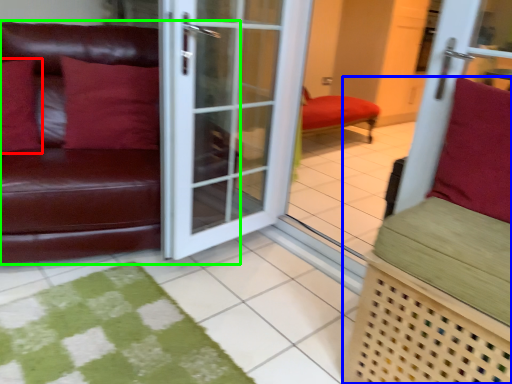
Question: Which is farther away from pillow (highlighted by a red box)? furniture (highlighted by a blue box) or studio couch (highlighted by a green box)?

Choices:
 (A) furniture
 (B) studio couch

Answer: (A)